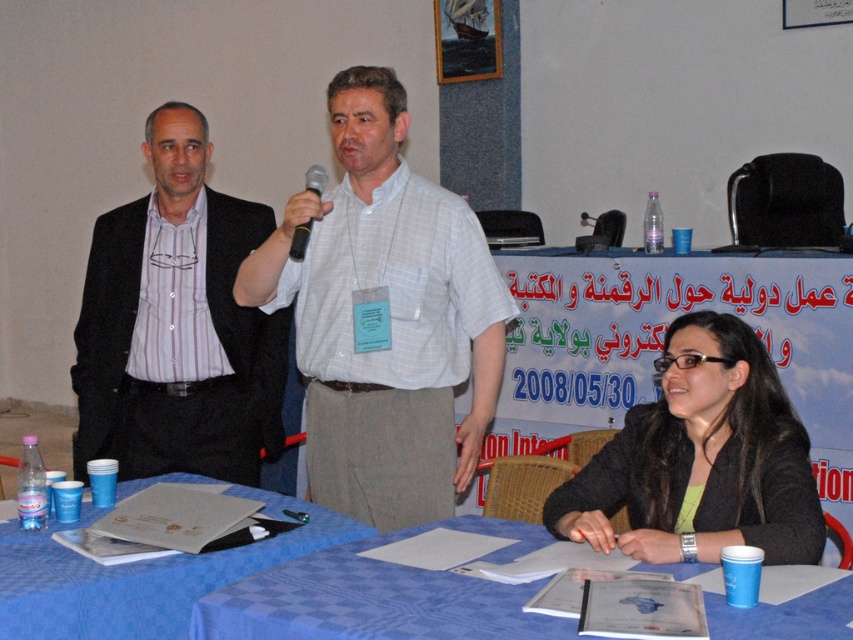
Question: From the image, what is the correct spatial relationship of light gray striped shirt at center in relation to matte black suit at left?

Choices:
 (A) left
 (B) right

Answer: (B)

Question: Does blue fabric table at center appear over black plastic microphone at center?

Choices:
 (A) no
 (B) yes

Answer: (A)

Question: Which point is closer to the camera?

Choices:
 (A) black glossy jacket at lower right
 (B) blue fabric table at lower center

Answer: (B)

Question: Estimate the real-world distances between objects in this image. Which object is farther from the light gray striped shirt at center?

Choices:
 (A) blue fabric table at lower center
 (B) blue fabric table at center
 (C) black plastic microphone at center
 (D) matte black suit at left

Answer: (A)

Question: From the image, what is the correct spatial relationship of black glossy jacket at lower right in relation to blue fabric table at center?

Choices:
 (A) left
 (B) right

Answer: (B)

Question: Which object is the farthest from the matte black suit at left?

Choices:
 (A) blue fabric table at center
 (B) black plastic microphone at center
 (C) black glossy jacket at lower right

Answer: (C)